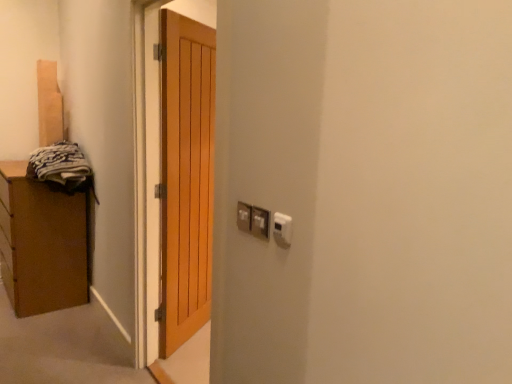
Question: Would you say metallic silver electrical outlet at center-right, which is the 2th electric outlet from back to front, contains dark gray fabric at left?

Choices:
 (A) yes
 (B) no

Answer: (B)

Question: Is metallic silver electrical outlet at center-right, positioned as the 2th electric outlet in front-to-back order, oriented away from dark gray fabric at left?

Choices:
 (A) yes
 (B) no

Answer: (B)

Question: Is metallic silver electrical outlet at center-right, which is the 2th electric outlet from back to front, positioned in front of dark gray fabric at left?

Choices:
 (A) yes
 (B) no

Answer: (A)

Question: Considering the relative positions of metallic silver electrical outlet at center-right, positioned as the 2th electric outlet in front-to-back order, and dark gray fabric at left in the image provided, is metallic silver electrical outlet at center-right, positioned as the 2th electric outlet in front-to-back order, to the right of dark gray fabric at left from the viewer's perspective?

Choices:
 (A) no
 (B) yes

Answer: (B)

Question: From the image's perspective, is metallic silver electrical outlet at center-right, positioned as the 2th electric outlet in front-to-back order, beneath dark gray fabric at left?

Choices:
 (A) no
 (B) yes

Answer: (B)

Question: From the image's perspective, relative to dark gray fabric at left, is white plastic electric outlet at center, which appears as the first electric outlet when viewed from the back, above or below?

Choices:
 (A) above
 (B) below

Answer: (B)

Question: Would you say white plastic electric outlet at center, which appears as the first electric outlet when viewed from the back, is inside or outside dark gray fabric at left?

Choices:
 (A) outside
 (B) inside

Answer: (A)

Question: Considering their positions, is white plastic electric outlet at center, which is counted as the 3th electric outlet, starting from the front, located in front of or behind dark gray fabric at left?

Choices:
 (A) front
 (B) behind

Answer: (A)

Question: Considering the positions of white plastic electric outlet at center, which is counted as the 3th electric outlet, starting from the front, and dark gray fabric at left in the image, is white plastic electric outlet at center, which is counted as the 3th electric outlet, starting from the front, wider or thinner than dark gray fabric at left?

Choices:
 (A) thin
 (B) wide

Answer: (A)

Question: From their relative heights in the image, would you say dark gray fabric at left is taller or shorter than white plastic electric outlet at center, which is counted as the 3th electric outlet, starting from the front?

Choices:
 (A) tall
 (B) short

Answer: (A)

Question: Considering their positions, is dark gray fabric at left located in front of or behind white plastic electric outlet at center, which is counted as the 3th electric outlet, starting from the front?

Choices:
 (A) behind
 (B) front

Answer: (A)

Question: Is dark gray fabric at left wider or thinner than white plastic electric outlet at center, which appears as the first electric outlet when viewed from the back?

Choices:
 (A) thin
 (B) wide

Answer: (B)

Question: Is point (37, 157) closer or farther from the camera than point (244, 226)?

Choices:
 (A) closer
 (B) farther

Answer: (B)

Question: From a real-world perspective, relative to dark gray fabric at left, is metallic silver electrical outlet at center-right, positioned as the 2th electric outlet in front-to-back order, vertically above or below?

Choices:
 (A) below
 (B) above

Answer: (B)

Question: From the image's perspective, is metallic silver electrical outlet at center-right, positioned as the 2th electric outlet in front-to-back order, above or below dark gray fabric at left?

Choices:
 (A) below
 (B) above

Answer: (A)